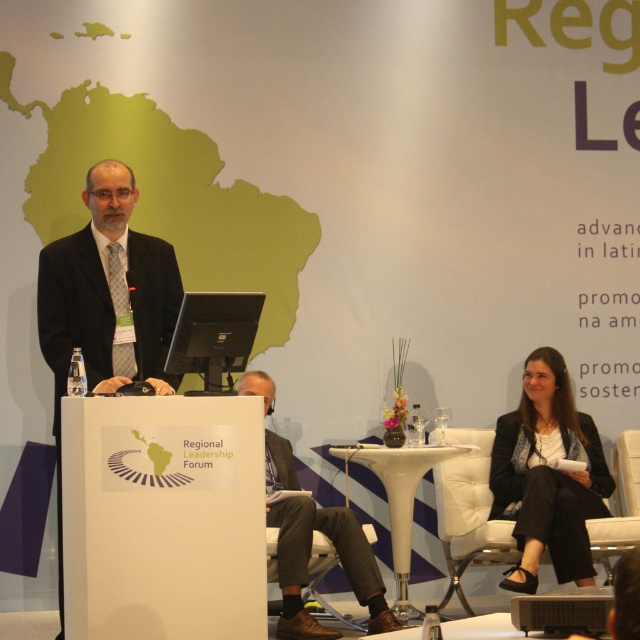
Between black suit at center and dark gray suit at center, which one appears on the right side from the viewer's perspective?

Positioned to the right is dark gray suit at center.

Is black suit at center bigger than dark gray suit at center?

No.

Which is in front, point (161, 269) or point (292, 467)?

Point (161, 269) is more forward.

Locate an element on the screen. black suit at center is located at coordinates (106, 304).

Can you confirm if black suit at center is positioned below white leather chair at lower right?

No.

Between point (141, 333) and point (620, 518), which one is positioned behind?

Point (620, 518)

Image resolution: width=640 pixels, height=640 pixels. Identify the location of black suit at center. click(x=106, y=304).

The height and width of the screenshot is (640, 640). Describe the element at coordinates (106, 304) in the screenshot. I see `black suit at center` at that location.

Is the position of black suit at center less distant than that of black fabric jacket at lower right?

A: Yes.

This screenshot has width=640, height=640. Find the location of `black suit at center`. black suit at center is located at coordinates (106, 304).

Find the location of a particular element. black suit at center is located at coordinates (106, 304).